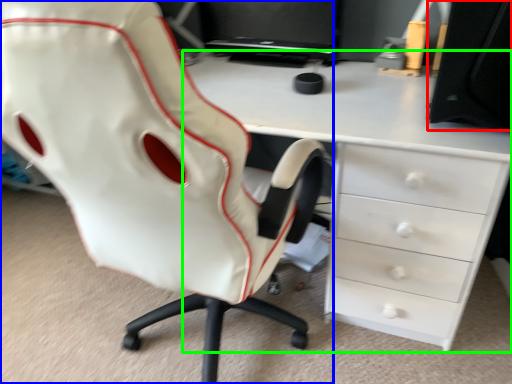
Question: Which object is positioned farthest from desktop (highlighted by a red box)? Select from chair (highlighted by a blue box) and desk (highlighted by a green box).

Choices:
 (A) chair
 (B) desk

Answer: (A)